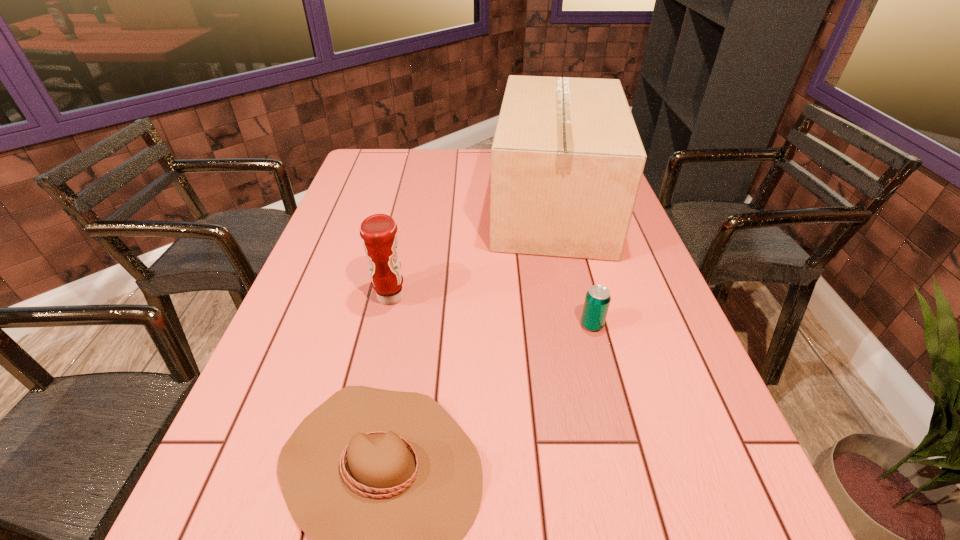
Find the location of `free spot between the second shortest object and the third shortest object`. free spot between the second shortest object and the third shortest object is located at coordinates (492, 311).

Locate an element on the screen. The image size is (960, 540). object identified as the second closest to the third tallest object is located at coordinates (387, 484).

Where is `the second closest object relative to the second farthest object`? The width and height of the screenshot is (960, 540). the second closest object relative to the second farthest object is located at coordinates (567, 160).